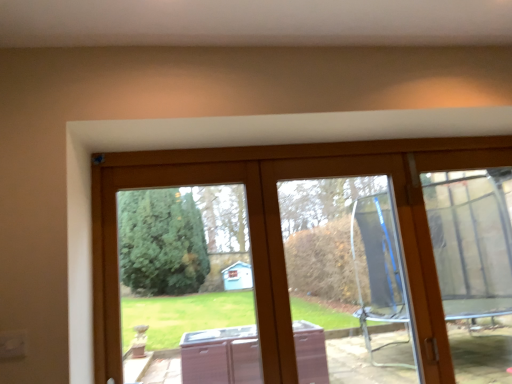
Question: Is transparent glass door at center bigger than clear glass door at center?

Choices:
 (A) yes
 (B) no

Answer: (A)

Question: From the image's perspective, is transparent glass door at center above clear glass door at center?

Choices:
 (A) no
 (B) yes

Answer: (A)

Question: Considering the relative positions of transparent glass door at center and clear glass door at center in the image provided, is transparent glass door at center behind clear glass door at center?

Choices:
 (A) yes
 (B) no

Answer: (B)

Question: From a real-world perspective, is transparent glass door at center on top of clear glass door at center?

Choices:
 (A) yes
 (B) no

Answer: (B)

Question: Does transparent glass door at center come in front of clear glass door at center?

Choices:
 (A) yes
 (B) no

Answer: (A)

Question: In the image, is clear glass door at center on the left side or the right side of clear plastic screen door at right?

Choices:
 (A) right
 (B) left

Answer: (B)

Question: From a real-world perspective, is clear glass door at center above or below clear plastic screen door at right?

Choices:
 (A) below
 (B) above

Answer: (B)

Question: In the image, is clear glass door at center positioned in front of or behind clear plastic screen door at right?

Choices:
 (A) behind
 (B) front

Answer: (B)

Question: From the image's perspective, is clear glass door at center located above or below clear plastic screen door at right?

Choices:
 (A) above
 (B) below

Answer: (B)

Question: Choose the correct answer: Is clear plastic screen door at right inside transparent glass door at center or outside it?

Choices:
 (A) inside
 (B) outside

Answer: (A)

Question: From the image's perspective, is clear plastic screen door at right located above or below transparent glass door at center?

Choices:
 (A) above
 (B) below

Answer: (A)

Question: From a real-world perspective, relative to transparent glass door at center, is clear plastic screen door at right vertically above or below?

Choices:
 (A) below
 (B) above

Answer: (B)

Question: Does point (443, 183) appear closer or farther from the camera than point (282, 375)?

Choices:
 (A) closer
 (B) farther

Answer: (B)

Question: Is point (510, 283) positioned closer to the camera than point (273, 382)?

Choices:
 (A) farther
 (B) closer

Answer: (A)

Question: From the image's perspective, is clear plastic screen door at right positioned above or below clear glass door at center?

Choices:
 (A) above
 (B) below

Answer: (A)